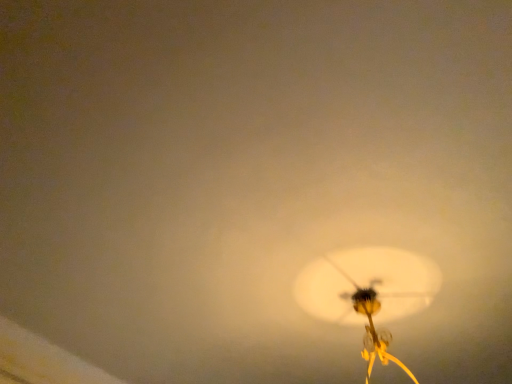
Question: Should I look upward or downward to see translucent plastic lamp at center?

Choices:
 (A) up
 (B) down

Answer: (B)